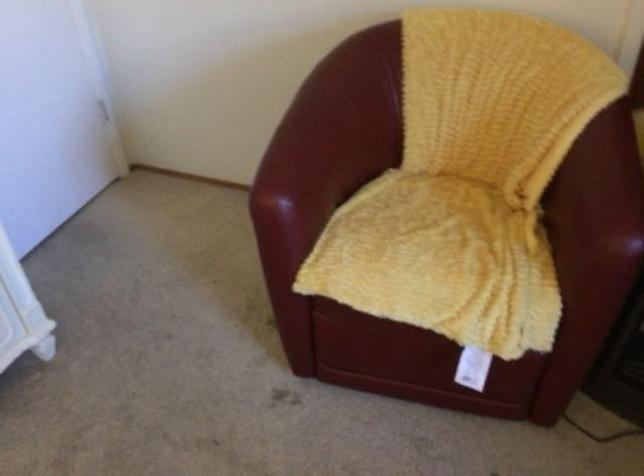
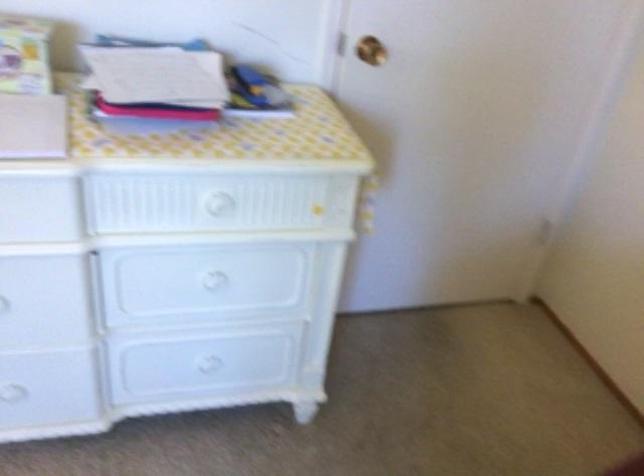
Question: Based on the continuous images, in which direction is the camera rotating? Reply with the corresponding letter.

Choices:
 (A) Left
 (B) Right
 (C) Up
 (D) Down

Answer: (A)